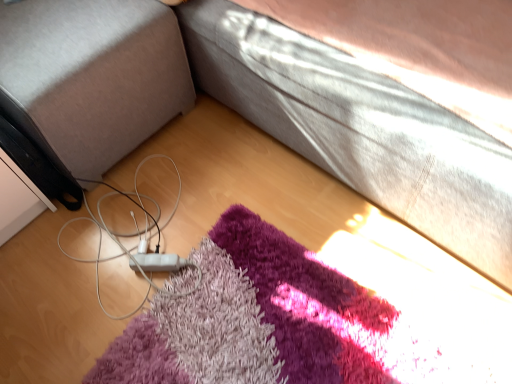
Question: Is matte black speaker at lower left in front of or behind white matte cable at lower left in the image?

Choices:
 (A) front
 (B) behind

Answer: (A)

Question: From the image's perspective, relative to white matte cable at lower left, is matte black speaker at lower left above or below?

Choices:
 (A) above
 (B) below

Answer: (A)

Question: From a real-world perspective, is matte black speaker at lower left positioned above or below white matte cable at lower left?

Choices:
 (A) above
 (B) below

Answer: (A)

Question: From a real-world perspective, relative to matte black speaker at lower left, is white matte cable at lower left vertically above or below?

Choices:
 (A) below
 (B) above

Answer: (A)

Question: From the image's perspective, is white matte cable at lower left located above or below matte black speaker at lower left?

Choices:
 (A) below
 (B) above

Answer: (A)

Question: Considering the positions of white matte cable at lower left and matte black speaker at lower left in the image, is white matte cable at lower left bigger or smaller than matte black speaker at lower left?

Choices:
 (A) big
 (B) small

Answer: (B)

Question: In terms of height, does white matte cable at lower left look taller or shorter compared to matte black speaker at lower left?

Choices:
 (A) short
 (B) tall

Answer: (A)